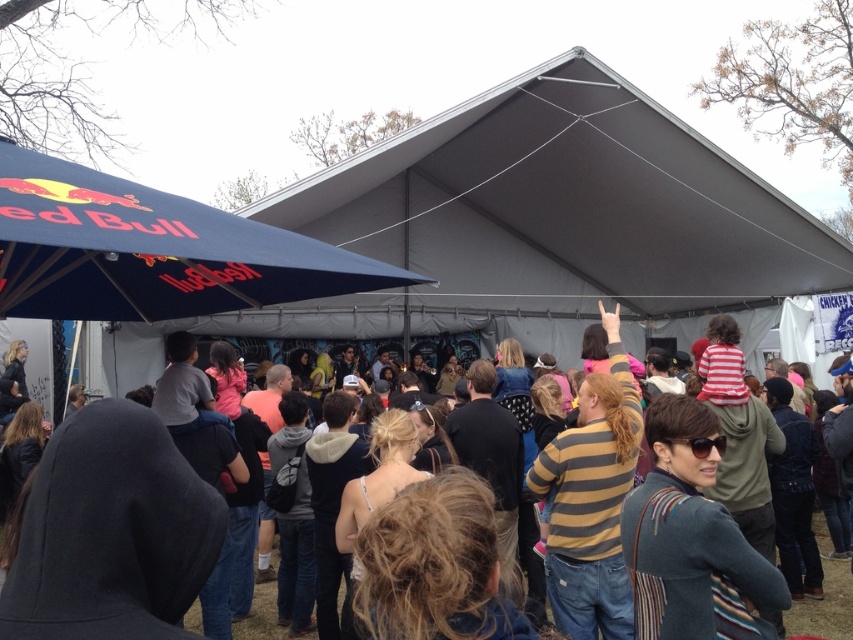
Question: Which point is farther to the camera?

Choices:
 (A) striped sweater at center
 (B) navy blue fabric canopy at upper left

Answer: (A)

Question: Can you confirm if navy blue fabric canopy at upper left is thinner than striped sweater at center?

Choices:
 (A) yes
 (B) no

Answer: (A)

Question: Is navy blue fabric canopy at upper left above striped sweater at center?

Choices:
 (A) no
 (B) yes

Answer: (B)

Question: Which object is farther from the camera taking this photo?

Choices:
 (A) striped sweater at center
 (B) navy blue fabric canopy at upper left

Answer: (A)

Question: Which of the following is the closest to the observer?

Choices:
 (A) navy blue fabric canopy at upper left
 (B) striped sweater at center

Answer: (A)

Question: Can you confirm if navy blue fabric canopy at upper left is bigger than striped sweater at center?

Choices:
 (A) yes
 (B) no

Answer: (B)